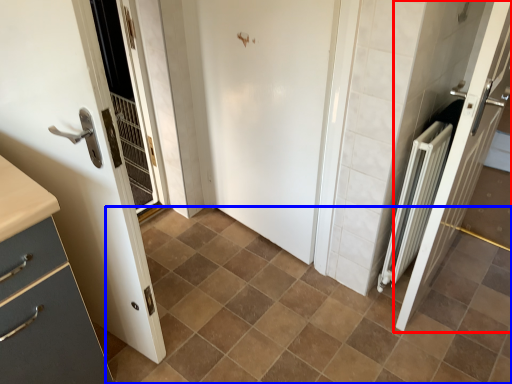
Question: Which of the following is the farthest to the observer, door (highlighted by a red box) or ceramic tile (highlighted by a blue box)?

Choices:
 (A) door
 (B) ceramic tile

Answer: (B)